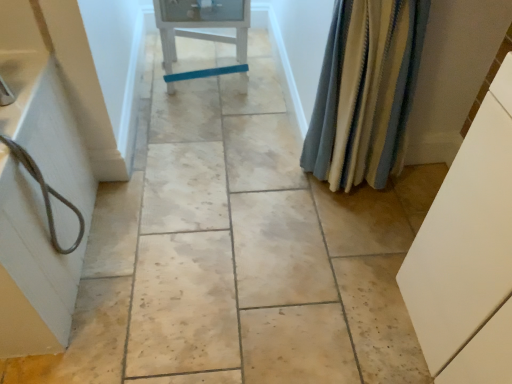
This screenshot has width=512, height=384. In order to click on free space that is in between white matte cabinet at right and striped fabric shower curtain at right in this screenshot , I will do `click(365, 251)`.